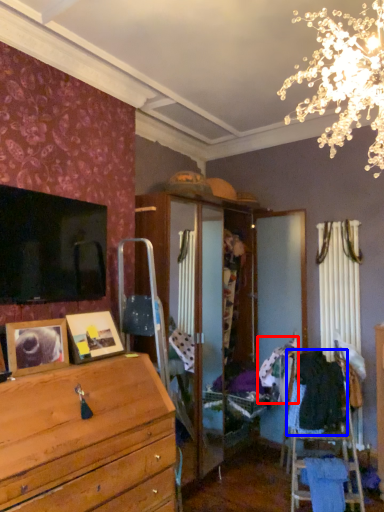
Question: Which object appears farthest to the camera in this image, clothing (highlighted by a red box) or clothing (highlighted by a blue box)?

Choices:
 (A) clothing
 (B) clothing

Answer: (A)